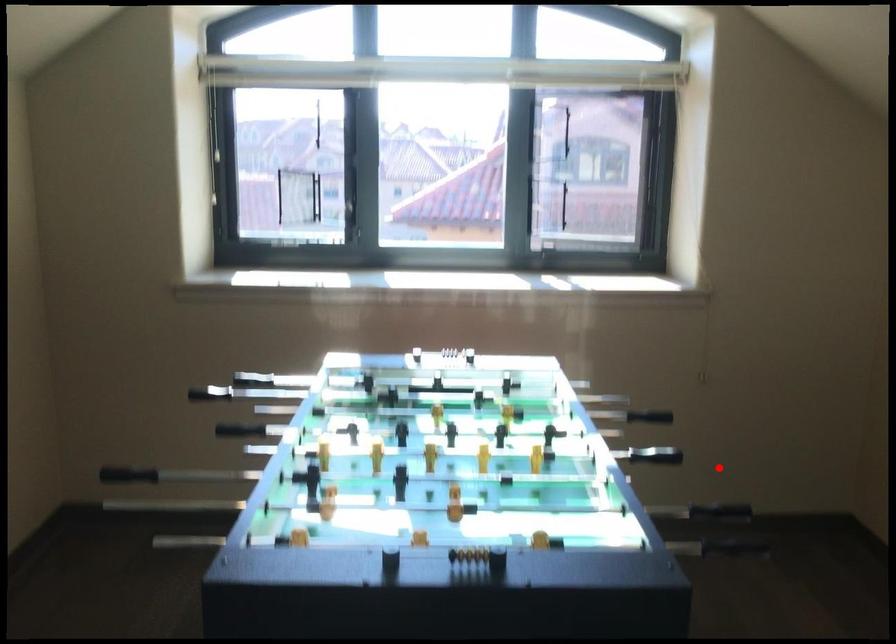
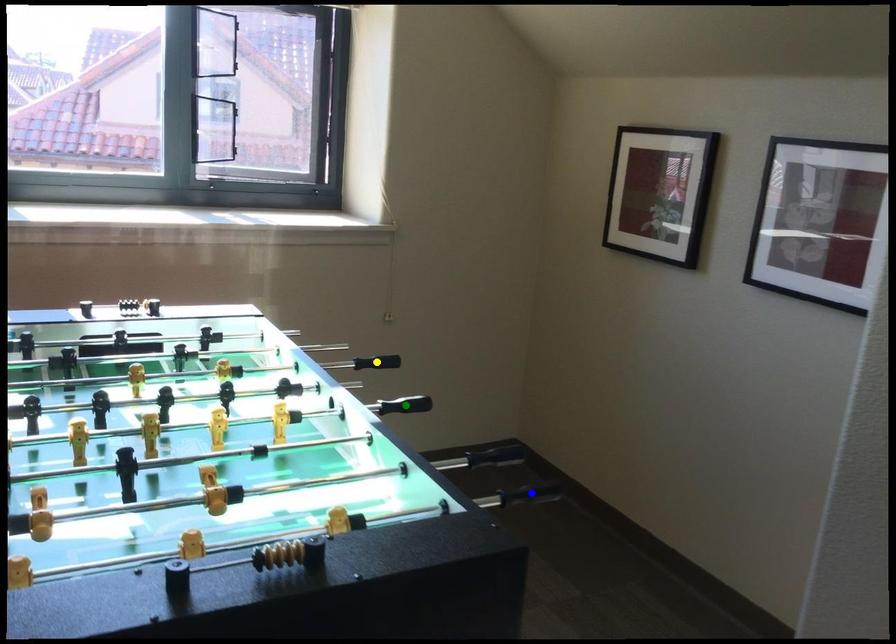
Question: I am providing you with two images of the same scene from different viewpoints. A red point is marked on the first image. You are given multiple points on the second image. Which mark in image 2 goes with the point in image 1?

Choices:
 (A) yellow point
 (B) green point
 (C) blue point

Answer: (B)